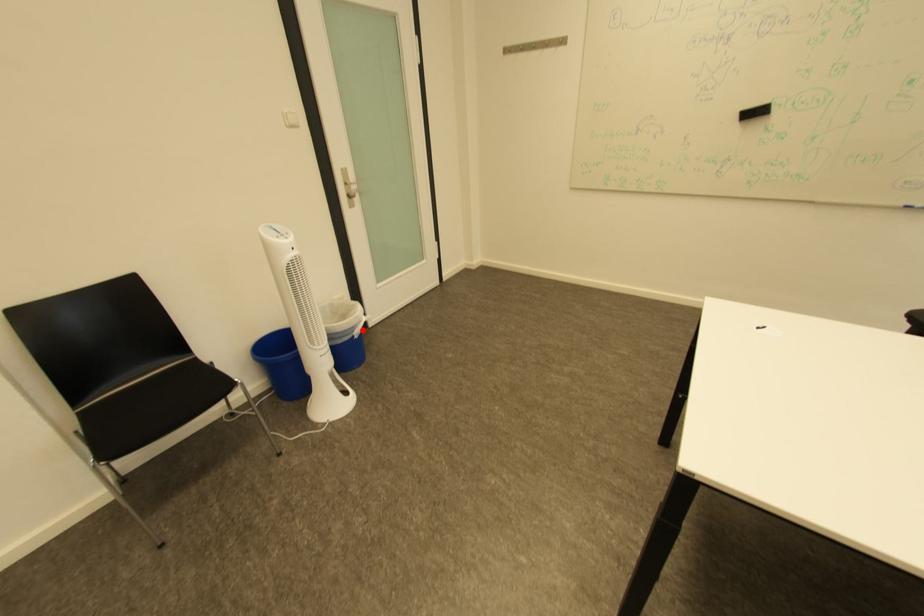
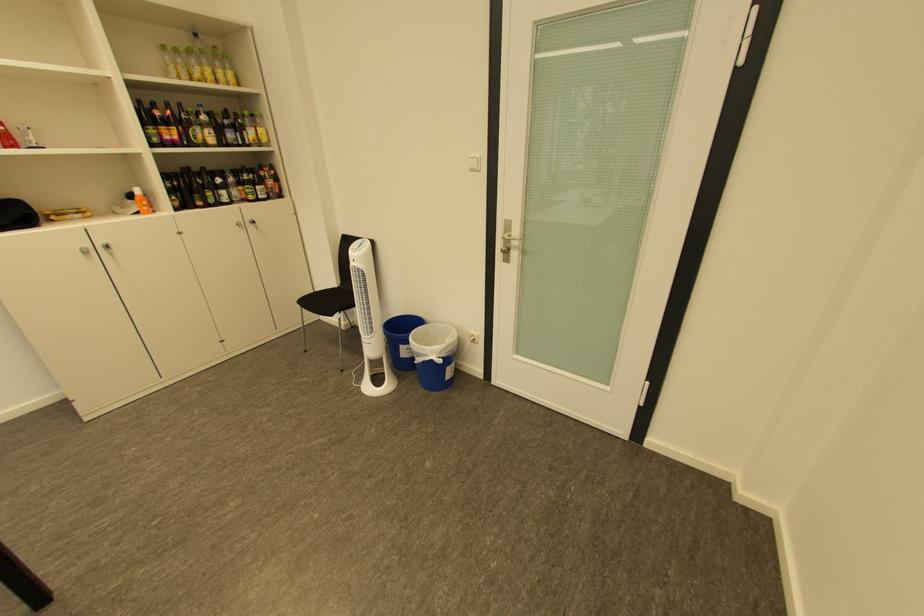
The point at the highlighted location is marked in the first image. Where is the corresponding point in the second image?

(429, 355)